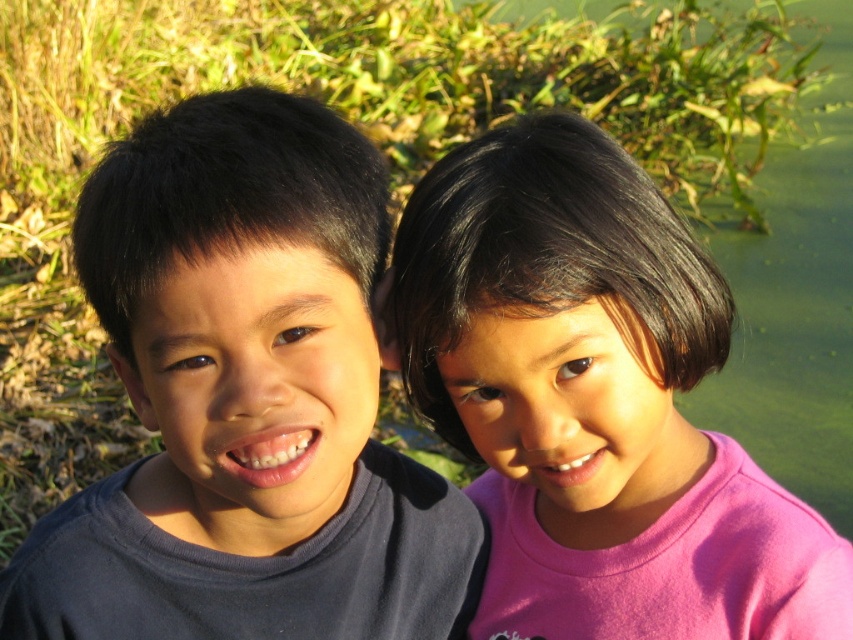
Question: Does matte dark blue shirt at left have a smaller size compared to pink matte shirt at right?

Choices:
 (A) yes
 (B) no

Answer: (A)

Question: Which point appears closest to the camera in this image?

Choices:
 (A) (144, 157)
 (B) (532, 548)

Answer: (A)

Question: Which point is closer to the camera?

Choices:
 (A) (281, 420)
 (B) (514, 460)

Answer: (A)

Question: Is matte dark blue shirt at left bigger than pink matte shirt at right?

Choices:
 (A) yes
 (B) no

Answer: (B)

Question: Is matte dark blue shirt at left below pink matte shirt at right?

Choices:
 (A) yes
 (B) no

Answer: (A)

Question: Which point is farther to the camera?

Choices:
 (A) (587, 330)
 (B) (186, 566)

Answer: (B)